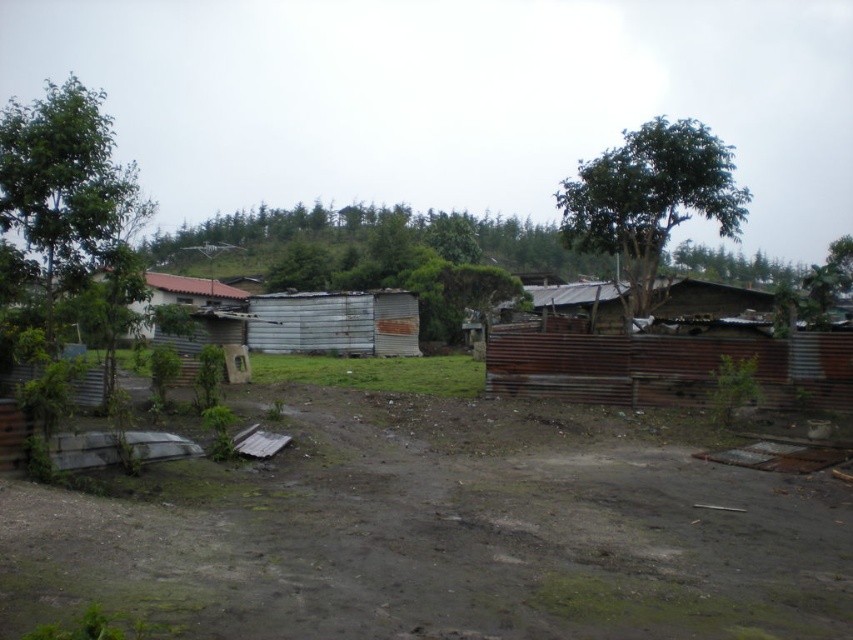
Is dull brown dirt track at center taller than green leafy tree at upper right?

Incorrect, dull brown dirt track at center's height is not larger of green leafy tree at upper right's.

I want to click on dull brown dirt track at center, so click(x=445, y=536).